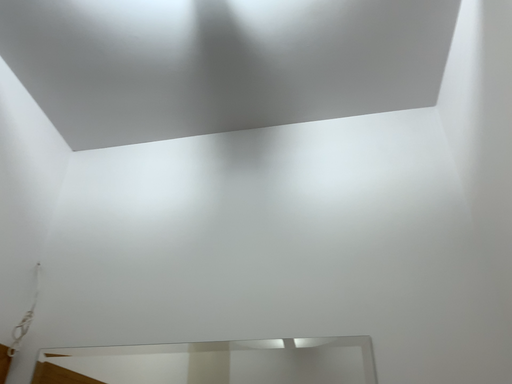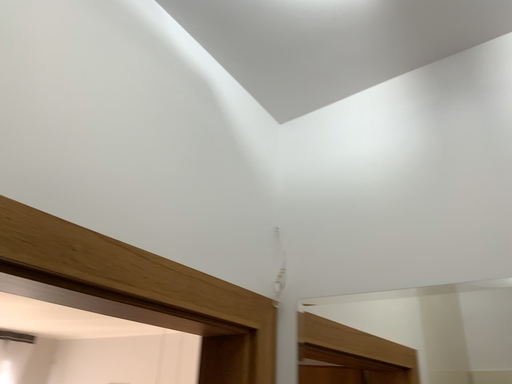
Question: Which way did the camera rotate in the video?

Choices:
 (A) rotated left
 (B) rotated right

Answer: (A)